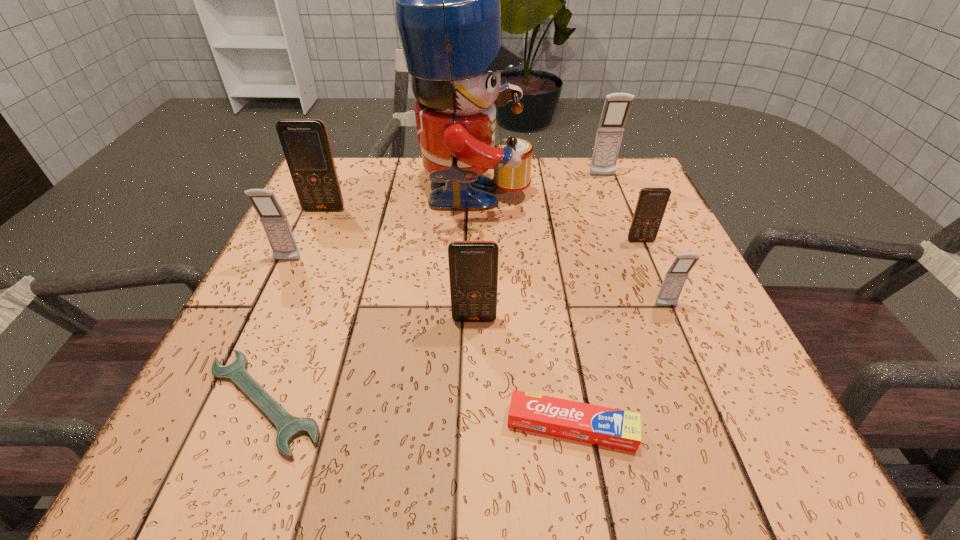
The height and width of the screenshot is (540, 960). I want to click on nutcracker, so click(x=447, y=0).

Locate an element on the screen. This screenshot has height=540, width=960. blue nutcracker is located at coordinates (447, 0).

At what (x,y) coordinates should I click in order to perform the action: click on the farthest gray cellular telephone. Please return your answer as a coordinate pair (x, y). The image size is (960, 540). Looking at the image, I should click on (616, 108).

Locate an element on the screen. This screenshot has height=540, width=960. the biggest gray cellular telephone is located at coordinates (616, 108).

Find the location of a particular element. This screenshot has width=960, height=540. the biggest orange cellular telephone is located at coordinates (305, 143).

Find the location of `the farthest orange cellular telephone`. the farthest orange cellular telephone is located at coordinates (305, 143).

I want to click on the second smallest gray cellular telephone, so click(274, 221).

Identify the location of the leftmost gray cellular telephone. (274, 221).

Locate an element on the screen. the seventh farthest object is located at coordinates (473, 265).

I want to click on the fourth cellular telephone from right to left, so click(x=473, y=265).